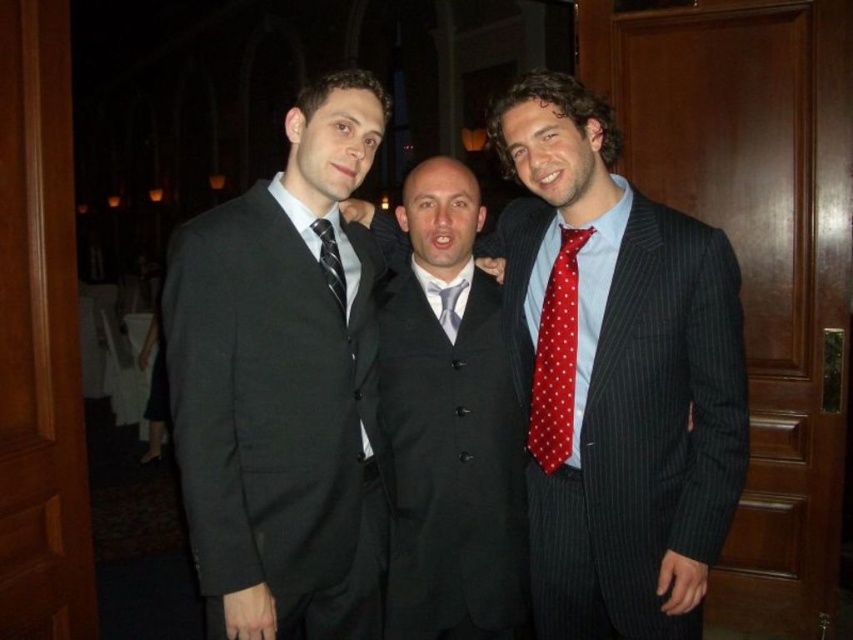
You are a photographer at a formal event. You need to adjust the camera focus so that both the black wool suit at left and the black silk tie at center are clearly visible. Given their height difference, which one should you focus on first to ensure proper framing?

The black wool suit at left is much taller than the black silk tie at center, so you should focus on the black wool suit at left first to ensure proper framing.

Consider the image. You are a photographer at a formal event. You need to arrange the two men wearing the pinstriped suit at center and the red dotted tie at right for a group photo. Based on their current positions, which man should move to the left to create space for the third person joining the photo?

The pinstriped suit at center should move to the left because the pinstriped suit at center is positioned on the right side of red dotted tie at right, so moving the pinstriped suit at center to the left would create space between them for the third person.

You are a photographer setting up for a group photo. You need to ensure that all clothing items in the frame are visible. Given that the pinstriped suit at center and the silvery satin tie at center are both in the center, which clothing item would require more space horizontally to be fully captured in the photo?

The pinstriped suit at center requires more horizontal space because its width is larger than the silvery satin tie at center.